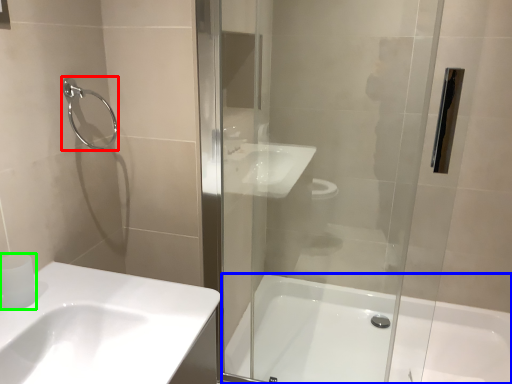
Question: Which is nearer to the shower (highlighted by a red box)? bathtub (highlighted by a blue box) or toilet paper (highlighted by a green box).

Choices:
 (A) bathtub
 (B) toilet paper

Answer: (B)